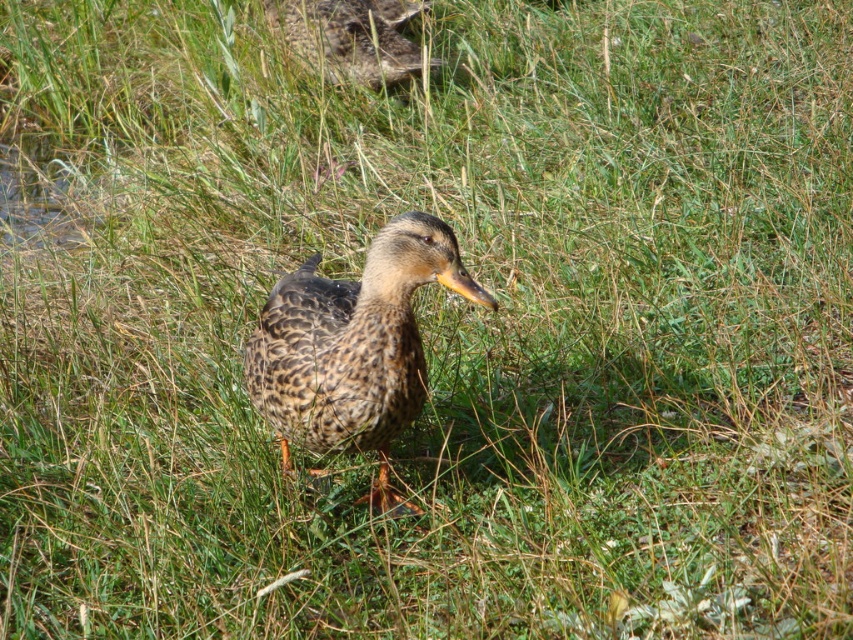
Between speckled feathered duck at center and speckled feathered duck at upper center, which one is positioned lower?

Positioned lower is speckled feathered duck at center.

Does point (416, 404) lie in front of point (302, 44)?

That is True.

You are a GUI agent. You are given a task and a screenshot of the screen. Output one action in this format:
    pyautogui.click(x=<x>, y=<y>)
    Task: Click on the speckled feathered duck at center
    The height and width of the screenshot is (640, 853).
    Given the screenshot: What is the action you would take?
    pyautogui.click(x=352, y=348)